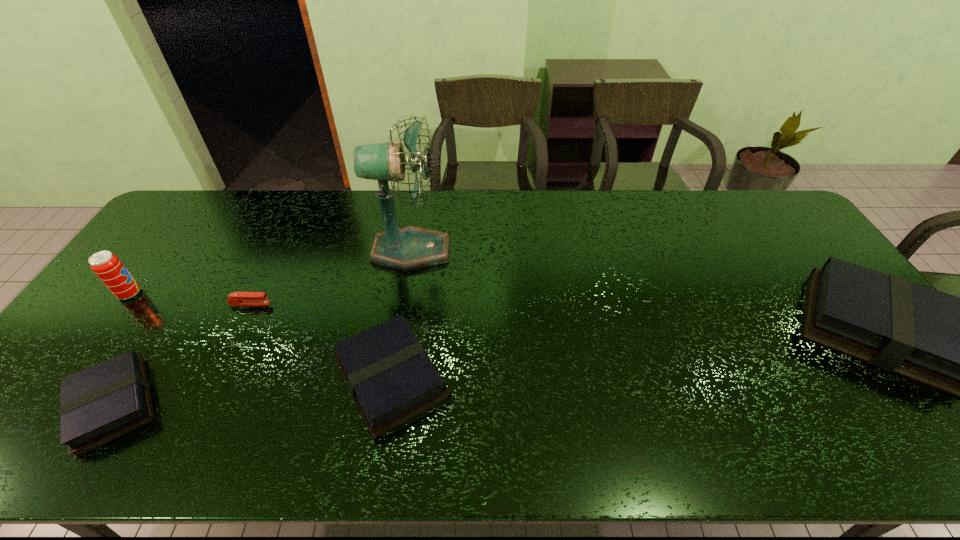
The height and width of the screenshot is (540, 960). I want to click on unoccupied area between the fan and the leftmost object, so click(271, 272).

In order to click on object that is the closest to the stapler in this screenshot , I will do `click(99, 404)`.

Find the location of a particular element. This screenshot has height=540, width=960. object that is the fourth closest one to the fourth object from right to left is located at coordinates (107, 266).

Identify which book is the second closest to the second shortest book. Please provide its 2D coordinates. Your answer should be formatted as a tuple, i.e. [(x, y)], where the tuple contains the x and y coordinates of a point satisfying the conditions above.

[(959, 346)]

Where is `the closest book to the tallest object`? This screenshot has height=540, width=960. the closest book to the tallest object is located at coordinates (391, 377).

Where is `vacant space that satisfies the following two spatial constraints: 1. in front of the second shortest book where the wind blows; 2. on the right side of the fan`? vacant space that satisfies the following two spatial constraints: 1. in front of the second shortest book where the wind blows; 2. on the right side of the fan is located at coordinates (391, 377).

Find the location of a particular element. The height and width of the screenshot is (540, 960). vacant space that satisfies the following two spatial constraints: 1. in front of the second tallest book where the wind blows; 2. on the right side of the tallest object is located at coordinates (391, 377).

This screenshot has width=960, height=540. Identify the location of blank space that satisfies the following two spatial constraints: 1. in front of the third shortest object where the wind blows; 2. on the left side of the fan. (391, 377).

The width and height of the screenshot is (960, 540). I want to click on vacant space that satisfies the following two spatial constraints: 1. on the front side of the fifth shortest object; 2. on the right side of the leftmost book, so click(x=47, y=405).